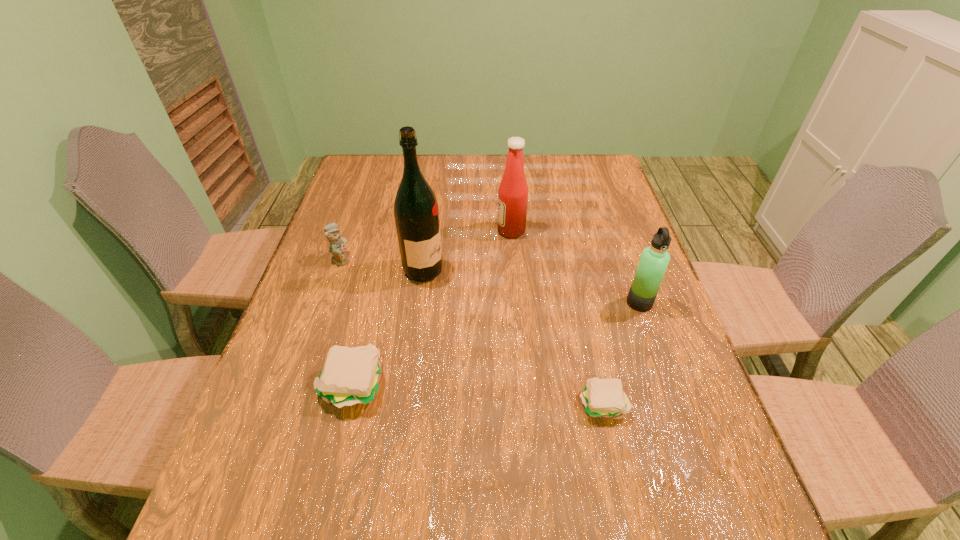
Locate an element on the screen. This screenshot has height=540, width=960. teddy bear situated at the left edge is located at coordinates (337, 247).

Identify the location of patty at the right edge. (604, 398).

Where is `thermos bottle that is at the right edge`? thermos bottle that is at the right edge is located at coordinates (654, 260).

You are a GUI agent. You are given a task and a screenshot of the screen. Output one action in this format:
    pyautogui.click(x=<x>, y=<y>)
    Task: Click on the vacant space at the far edge of the desktop
    This screenshot has height=540, width=960.
    Given the screenshot: What is the action you would take?
    pyautogui.click(x=465, y=188)

Image resolution: width=960 pixels, height=540 pixels. In the image, there is a desktop. Identify the location of vacant space at the near edge. (459, 435).

Image resolution: width=960 pixels, height=540 pixels. Identify the location of vacant region at the left edge. (326, 411).

Identify the location of blank area at the right edge. Image resolution: width=960 pixels, height=540 pixels. (621, 305).

Identify the location of free space at the far left corner of the desktop. The image size is (960, 540). (388, 170).

Image resolution: width=960 pixels, height=540 pixels. In order to click on vacant space at the far right corner of the desktop in this screenshot , I will do `click(578, 173)`.

Find the location of `free space at the near right corner`. free space at the near right corner is located at coordinates (696, 437).